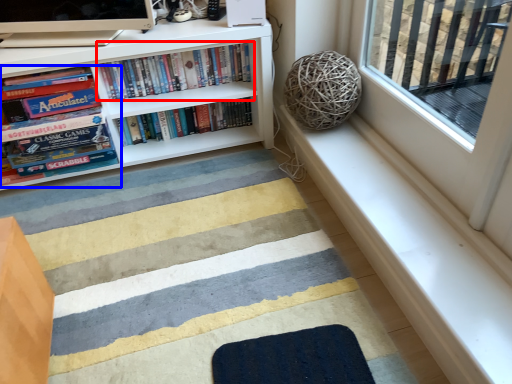
Question: Which object appears closest to the camera in this image, book (highlighted by a red box) or book (highlighted by a blue box)?

Choices:
 (A) book
 (B) book

Answer: (B)